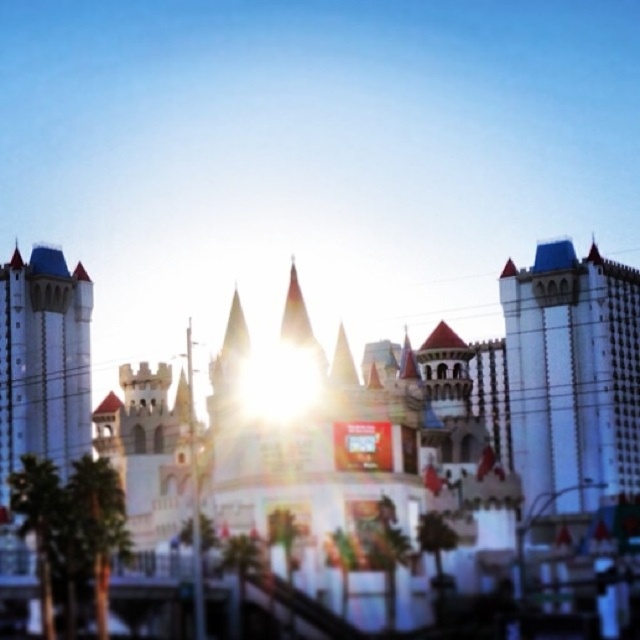
Who is shorter, white stone amusement park at center or white stone castle at left?

With less height is white stone castle at left.

Does white stone amusement park at center appear over white stone castle at left?

Indeed, white stone amusement park at center is positioned over white stone castle at left.

This screenshot has height=640, width=640. What do you see at coordinates (435, 429) in the screenshot?
I see `white stone amusement park at center` at bounding box center [435, 429].

The width and height of the screenshot is (640, 640). Identify the location of white stone amusement park at center. coord(435,429).

Image resolution: width=640 pixels, height=640 pixels. What are the coordinates of `white textured building at center` in the screenshot? It's located at (572, 374).

Can you confirm if white textured building at center is smaller than white stone castle at left?

No.

Does point (566, 467) come in front of point (74, 392)?

That is True.

Where is `white textured building at center`? white textured building at center is located at coordinates (572, 374).

Which is behind, point (29, 300) or point (534, 380)?

Positioned behind is point (534, 380).

Is white stone amusement park at center below white textured building at center?

No, white stone amusement park at center is not below white textured building at center.

Is point (538, 292) positioned before point (632, 493)?

No, (538, 292) is further to viewer.

Where is `white stone amusement park at center`? The width and height of the screenshot is (640, 640). white stone amusement park at center is located at coordinates (435, 429).